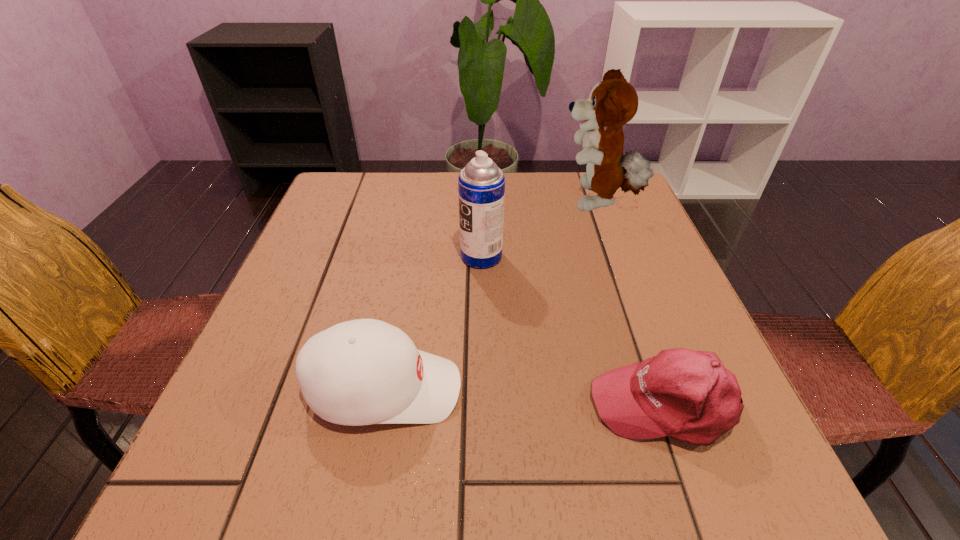
Find the location of a particular element. This screenshot has width=960, height=540. free space between the left baseball cap and the third shortest object is located at coordinates (433, 323).

Locate an element on the screen. This screenshot has width=960, height=540. free point between the third tallest object and the puppy is located at coordinates (491, 296).

You are a GUI agent. You are given a task and a screenshot of the screen. Output one action in this format:
    pyautogui.click(x=<x>, y=<y>)
    Task: Click on the free area in between the puppy and the taller baseball cap
    
    Given the screenshot: What is the action you would take?
    pyautogui.click(x=491, y=296)

I want to click on free area in between the third nearest object and the right baseball cap, so click(x=573, y=330).

Find the location of `unoccupied position between the tallest object and the shorter baseball cap`. unoccupied position between the tallest object and the shorter baseball cap is located at coordinates (631, 303).

The image size is (960, 540). What are the coordinates of `free area in between the left baseball cap and the shorter baseball cap` in the screenshot? It's located at (525, 397).

Locate an element on the screen. The image size is (960, 540). unoccupied area between the taller baseball cap and the third shortest object is located at coordinates (433, 323).

Locate an element on the screen. vacant area that lies between the second tallest object and the puppy is located at coordinates pyautogui.click(x=540, y=230).

Image resolution: width=960 pixels, height=540 pixels. Identify the location of free spot between the second tallest object and the shorter baseball cap. (573, 330).

Image resolution: width=960 pixels, height=540 pixels. I want to click on vacant area between the farthest object and the shortest object, so click(x=631, y=303).